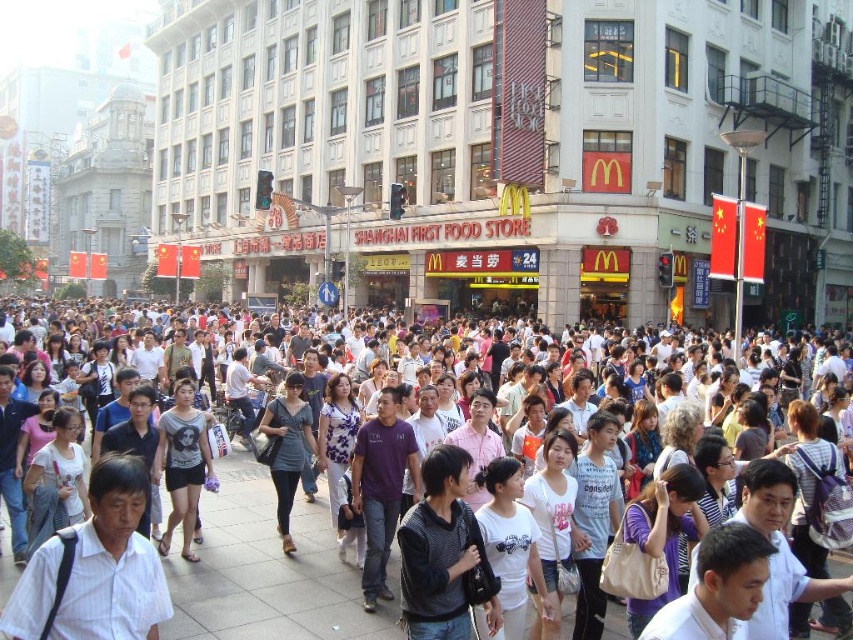
You are a drone operator who needs to deliver a package to the dark gray sweater at center. Your drone can only fly 100 meters before needing to recharge. If you are currently at the white stone building at center, can your drone make the delivery without needing to recharge?

The distance between the white stone building at center and the dark gray sweater at center is 98.67 meters. Since the drone can fly 100 meters before needing to recharge, it can make the delivery without needing to recharge because the distance is within its range.

You are a photographer standing in the bustling urban scene. You notice a dark gray sweater at center and a purple cotton shirt at center. Which clothing item is positioned lower in the image?

The dark gray sweater at center is located below the purple cotton shirt at center, so it is positioned lower in the image.